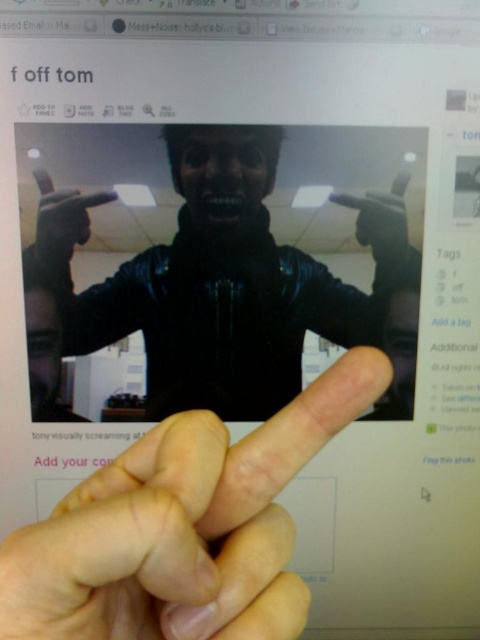
Question: Which object is farther from the camera taking this photo?

Choices:
 (A) black leather jacket at center
 (B) pink flesh-toned finger at center

Answer: (A)

Question: Is the position of black leather jacket at center more distant than that of pink flesh-toned finger at center?

Choices:
 (A) no
 (B) yes

Answer: (B)

Question: Does black leather jacket at center have a lesser width compared to pink flesh-toned finger at center?

Choices:
 (A) yes
 (B) no

Answer: (B)

Question: Does black leather jacket at center have a lesser width compared to pink flesh-toned finger at center?

Choices:
 (A) yes
 (B) no

Answer: (B)